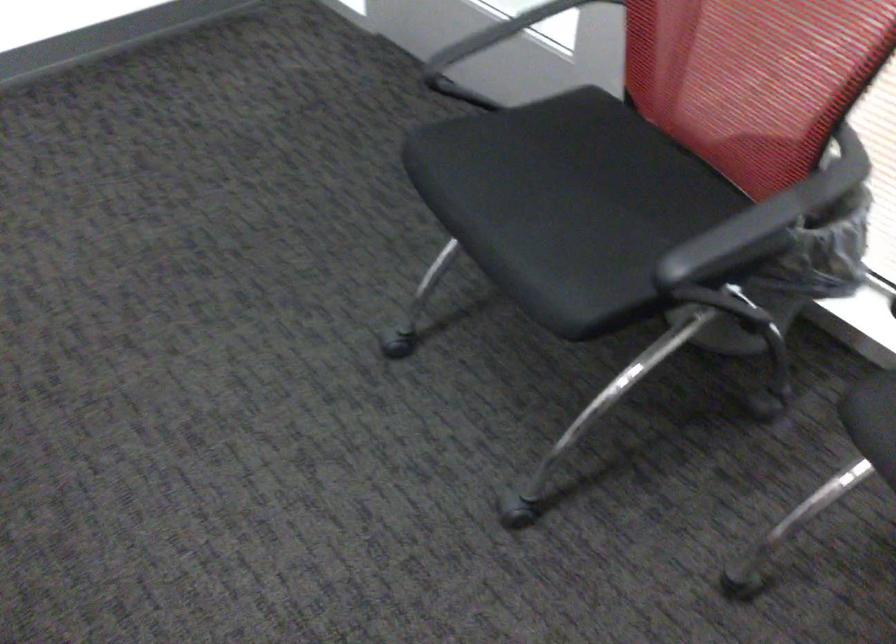
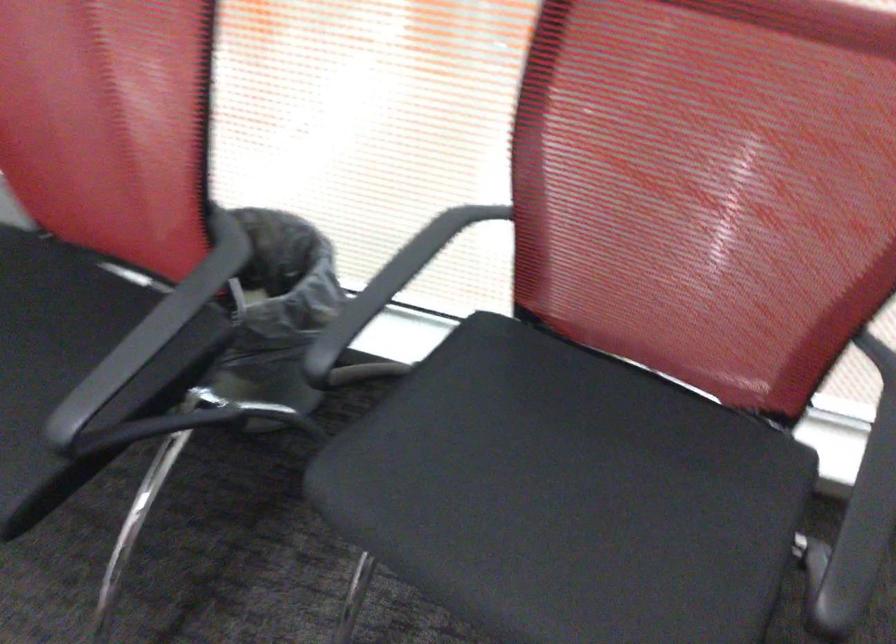
Find the pixel in the second image that matches [748,221] in the first image.

(140, 346)